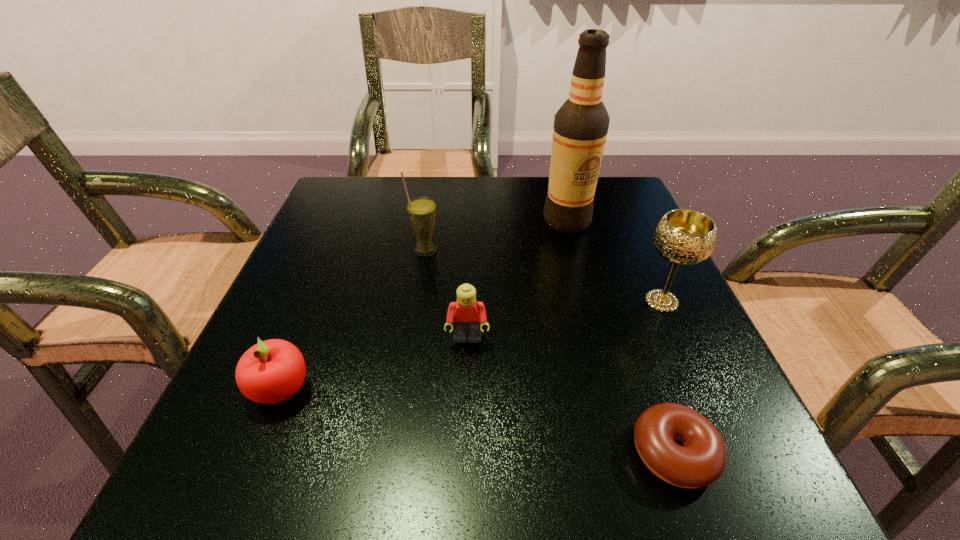
Find the location of a particular element. blank area located 0.060m on the back of the fifth object from right to left is located at coordinates (429, 226).

The height and width of the screenshot is (540, 960). I want to click on vacant space located 0.190m on the left of the fourth nearest object, so click(531, 301).

The image size is (960, 540). What are the coordinates of `vacant position located on the face of the Lego` in the screenshot? It's located at (467, 374).

The width and height of the screenshot is (960, 540). What are the coordinates of `blank area located on the front of the leftmost object` in the screenshot? It's located at (242, 487).

What are the coordinates of `free region located on the left of the doughnut` in the screenshot? It's located at (526, 453).

You are a GUI agent. You are given a task and a screenshot of the screen. Output one action in this format:
    pyautogui.click(x=<x>, y=<y>)
    Task: Click on the object that is at the far edge
    
    Given the screenshot: What is the action you would take?
    pyautogui.click(x=580, y=129)

This screenshot has height=540, width=960. Identify the location of object at the near edge. (701, 461).

You are a GUI agent. You are given a task and a screenshot of the screen. Output one action in this format:
    pyautogui.click(x=<x>, y=<y>)
    Task: Click on the object that is at the left edge
    
    Given the screenshot: What is the action you would take?
    pyautogui.click(x=271, y=371)

Where is `alcohol located at the right edge`? This screenshot has width=960, height=540. alcohol located at the right edge is located at coordinates (580, 129).

The image size is (960, 540). In order to click on chalice located in the right edge section of the desktop in this screenshot , I will do (683, 237).